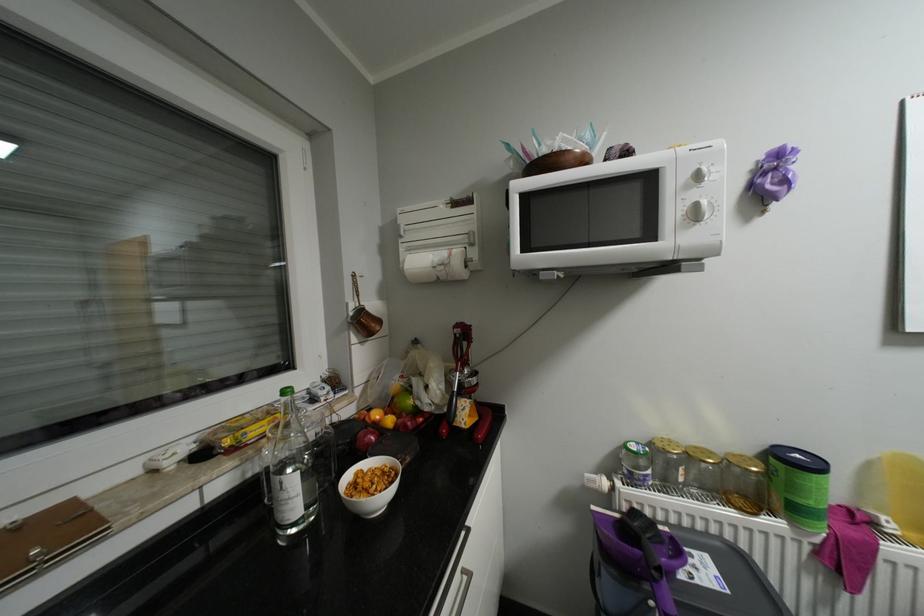
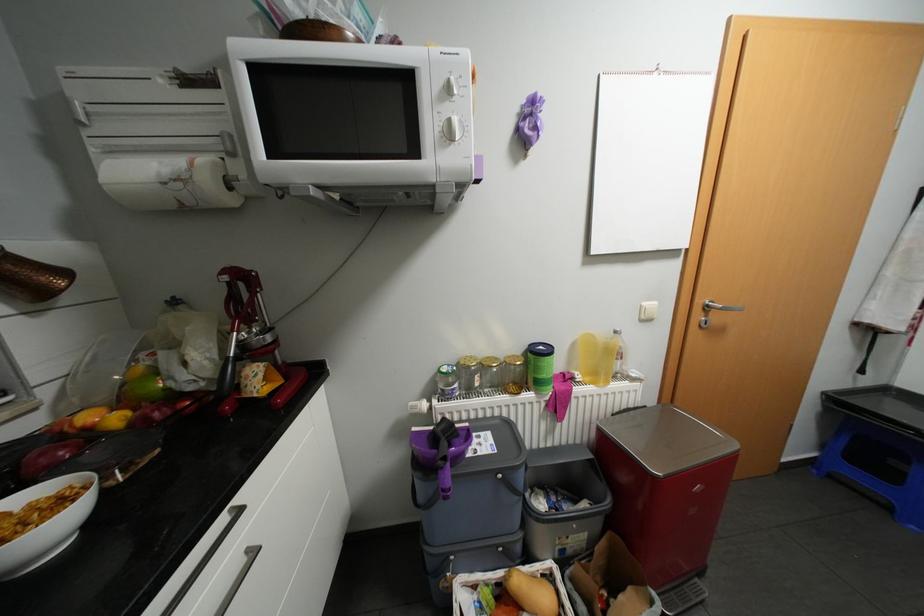
In the second image, find the point that corresponds to the point at 697,203 in the first image.

(452, 116)